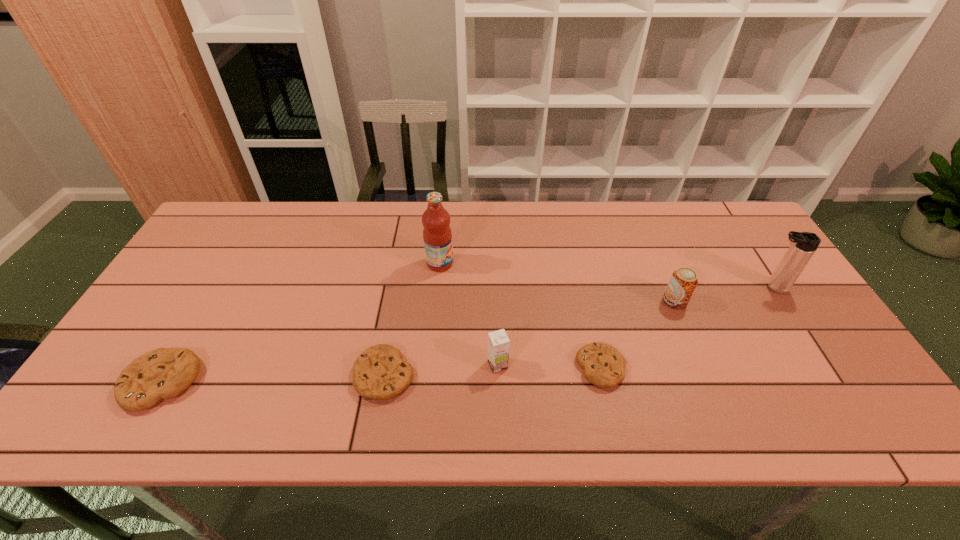
At what (x,y) coordinates should I click in order to perform the action: click on vacant point located between the tallest object and the beer can. Please return your answer as a coordinate pair (x, y). This screenshot has width=960, height=540. Looking at the image, I should click on (558, 282).

Identify the location of vacant space that's between the second object from right to left and the fourth object from right to left. The height and width of the screenshot is (540, 960). (587, 333).

Locate an element on the screen. vacant area between the second cookie from left to right and the second tallest object is located at coordinates (578, 331).

You are a GUI agent. You are given a task and a screenshot of the screen. Output one action in this format:
    pyautogui.click(x=<x>, y=<y>)
    Task: Click on the free spot between the rightmost object and the tallest object
    Image resolution: width=960 pixels, height=540 pixels.
    Given the screenshot: What is the action you would take?
    pyautogui.click(x=606, y=275)

Locate an element on the screen. Image resolution: width=960 pixels, height=540 pixels. free space between the rightmost object and the fruit juice is located at coordinates (606, 275).

Locate an element on the screen. empty space between the fourth object from right to left and the rightmost object is located at coordinates (635, 326).

The image size is (960, 540). What are the coordinates of `free space between the chocolate milk and the sixth object from left to right` in the screenshot? It's located at (587, 333).

I want to click on the sixth closest object to the beer can, so click(164, 373).

Locate which object ranks sixth in proximity to the sixth shortest object. Please provide its 2D coordinates. Your answer should be formatted as a tuple, i.e. [(x, y)], where the tuple contains the x and y coordinates of a point satisfying the conditions above.

[(164, 373)]

Choose which cookie is the nearest neighbor to the third object from right to left. Please provide its 2D coordinates. Your answer should be formatted as a tuple, i.e. [(x, y)], where the tuple contains the x and y coordinates of a point satisfying the conditions above.

[(379, 373)]